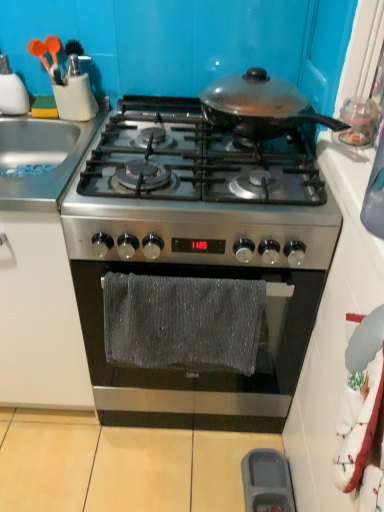
At what (x,y) coordinates should I click in order to perform the action: click on stainless steel gas stove at center, marked as the second gas stove in a top-to-bottom arrangement. Please return your answer as a coordinate pair (x, y). The width and height of the screenshot is (384, 512). Looking at the image, I should click on (196, 265).

In order to face stainless steel sink at left, should I rotate leftwards or rightwards?

You should look left and rotate roughly 21.708 degrees.

At what (x,y) coordinates should I click in order to perform the action: click on stainless steel gas stove at center, which appears as the 1th gas stove when viewed from the top. Please return your answer as a coordinate pair (x, y). Image resolution: width=384 pixels, height=512 pixels. Looking at the image, I should click on (197, 159).

The width and height of the screenshot is (384, 512). Identify the location of matte plastic utensils at upper left, which is counted as the second kitchen appliance, starting from the right. (12, 91).

Image resolution: width=384 pixels, height=512 pixels. Identify the location of stainless steel gas stove at center, marked as the second gas stove in a top-to-bottom arrangement. (196, 265).

Is point (221, 103) closer to camera compared to point (171, 339)?

No, it is not.

Between shiny black pan at center, arranged as the 2th kitchen appliance when viewed from the left, and gray textured towel at center, which one has larger size?

shiny black pan at center, arranged as the 2th kitchen appliance when viewed from the left, is bigger.

Who is shorter, shiny black pan at center, positioned as the first kitchen appliance in right-to-left order, or gray textured towel at center?

With less height is shiny black pan at center, positioned as the first kitchen appliance in right-to-left order.

Is shiny black pan at center, arranged as the 2th kitchen appliance when viewed from the left, aimed at gray textured towel at center?

No, shiny black pan at center, arranged as the 2th kitchen appliance when viewed from the left, is not oriented towards gray textured towel at center.

This screenshot has height=512, width=384. In order to click on sink that is above the stainless steel gas stove at center, marked as the second gas stove in a top-to-bottom arrangement (from a real-world perspective) in this screenshot , I will do click(x=42, y=158).

Is stainless steel sink at left positioned with its back to stainless steel gas stove at center, marked as the second gas stove in a top-to-bottom arrangement?

stainless steel sink at left does not have its back to stainless steel gas stove at center, marked as the second gas stove in a top-to-bottom arrangement.

Looking at this image, from the image's perspective, does stainless steel sink at left appear lower than stainless steel gas stove at center, positioned as the 1th gas stove in bottom-to-top order?

No, from the image's perspective, stainless steel sink at left is not below stainless steel gas stove at center, positioned as the 1th gas stove in bottom-to-top order.

Looking at this image, which is further, (44, 182) or (103, 137)?

The point (103, 137) is more distant.

Find the location of a particular element. This screenshot has width=384, height=512. the 2nd gas stove positioned above the gray textured towel at center (from the image's perspective) is located at coordinates (197, 159).

Which object is further away from the camera taking this photo, gray textured towel at center or stainless steel gas stove at center, the second gas stove in the bottom-to-top sequence?

gray textured towel at center is more distant.

Does gray textured towel at center appear on the left side of stainless steel gas stove at center, which appears as the 1th gas stove when viewed from the top?

Yes, gray textured towel at center is to the left of stainless steel gas stove at center, which appears as the 1th gas stove when viewed from the top.

Are stainless steel gas stove at center, positioned as the 1th gas stove in bottom-to-top order, and gray textured towel at center far apart?

stainless steel gas stove at center, positioned as the 1th gas stove in bottom-to-top order, is actually quite close to gray textured towel at center.

Who is more distant, stainless steel gas stove at center, marked as the second gas stove in a top-to-bottom arrangement, or gray textured towel at center?

stainless steel gas stove at center, marked as the second gas stove in a top-to-bottom arrangement, is behind.

From the image's perspective, does stainless steel gas stove at center, marked as the second gas stove in a top-to-bottom arrangement, appear lower than gray textured towel at center?

Actually, stainless steel gas stove at center, marked as the second gas stove in a top-to-bottom arrangement, appears above gray textured towel at center in the image.

Is stainless steel gas stove at center, positioned as the 1th gas stove in bottom-to-top order, smaller than gray textured towel at center?

Incorrect, stainless steel gas stove at center, positioned as the 1th gas stove in bottom-to-top order, is not smaller in size than gray textured towel at center.

From the image's perspective, which is below, stainless steel gas stove at center, marked as the second gas stove in a top-to-bottom arrangement, or shiny black pan at center, positioned as the first kitchen appliance in right-to-left order?

stainless steel gas stove at center, marked as the second gas stove in a top-to-bottom arrangement, from the image's perspective.

Is stainless steel gas stove at center, marked as the second gas stove in a top-to-bottom arrangement, to the left or to the right of shiny black pan at center, positioned as the first kitchen appliance in right-to-left order, in the image?

From the image, it's evident that stainless steel gas stove at center, marked as the second gas stove in a top-to-bottom arrangement, is to the left of shiny black pan at center, positioned as the first kitchen appliance in right-to-left order.

Which is in front, point (259, 223) or point (211, 96)?

Positioned in front is point (259, 223).

From a real-world perspective, is stainless steel gas stove at center, positioned as the 1th gas stove in bottom-to-top order, above or below shiny black pan at center, positioned as the first kitchen appliance in right-to-left order?

From a real-world perspective, stainless steel gas stove at center, positioned as the 1th gas stove in bottom-to-top order, is physically below shiny black pan at center, positioned as the first kitchen appliance in right-to-left order.

Considering the sizes of shiny black pan at center, positioned as the first kitchen appliance in right-to-left order, and gray plastic tray at lower center in the image, is shiny black pan at center, positioned as the first kitchen appliance in right-to-left order, bigger or smaller than gray plastic tray at lower center?

In the image, shiny black pan at center, positioned as the first kitchen appliance in right-to-left order, appears to be larger than gray plastic tray at lower center.

Is shiny black pan at center, positioned as the first kitchen appliance in right-to-left order, touching gray plastic tray at lower center?

No, shiny black pan at center, positioned as the first kitchen appliance in right-to-left order, is not next to gray plastic tray at lower center.

Is shiny black pan at center, arranged as the 2th kitchen appliance when viewed from the left, positioned before gray plastic tray at lower center?

Yes, shiny black pan at center, arranged as the 2th kitchen appliance when viewed from the left, is closer to the viewer.

Which is behind, point (276, 84) or point (288, 470)?

Positioned behind is point (276, 84).

Can you confirm if stainless steel sink at left is shorter than shiny black pan at center, arranged as the 2th kitchen appliance when viewed from the left?

No, stainless steel sink at left is not shorter than shiny black pan at center, arranged as the 2th kitchen appliance when viewed from the left.

From the image's perspective, between stainless steel sink at left and shiny black pan at center, positioned as the first kitchen appliance in right-to-left order, who is located below?

stainless steel sink at left, from the image's perspective.

Is stainless steel sink at left touching shiny black pan at center, arranged as the 2th kitchen appliance when viewed from the left?

No, stainless steel sink at left is not making contact with shiny black pan at center, arranged as the 2th kitchen appliance when viewed from the left.

From a real-world perspective, between stainless steel sink at left and shiny black pan at center, arranged as the 2th kitchen appliance when viewed from the left, who is vertically higher?

In real-world perspective, shiny black pan at center, arranged as the 2th kitchen appliance when viewed from the left, is above.

This screenshot has height=512, width=384. I want to click on material behind the shiny black pan at center, arranged as the 2th kitchen appliance when viewed from the left, so [x=182, y=322].

This screenshot has width=384, height=512. What are the coordinates of `gas stove that is the 2nd one when counting downward from the stainless steel sink at left (from the image's perspective)` in the screenshot? It's located at (196, 265).

Which object lies nearer to the anchor point gray textured towel at center, stainless steel gas stove at center, marked as the second gas stove in a top-to-bottom arrangement, or shiny black pan at center, positioned as the first kitchen appliance in right-to-left order?

stainless steel gas stove at center, marked as the second gas stove in a top-to-bottom arrangement.

From the image, which object appears to be nearer to stainless steel sink at left, shiny black pan at center, positioned as the first kitchen appliance in right-to-left order, or matte plastic utensils at upper left, the first kitchen appliance when ordered from left to right?

Among the two, matte plastic utensils at upper left, the first kitchen appliance when ordered from left to right, is located nearer to stainless steel sink at left.

From the image, which object appears to be nearer to gray plastic tray at lower center, stainless steel gas stove at center, positioned as the 1th gas stove in bottom-to-top order, or matte plastic utensils at upper left, which is counted as the second kitchen appliance, starting from the right?

Based on the image, stainless steel gas stove at center, positioned as the 1th gas stove in bottom-to-top order, appears to be nearer to gray plastic tray at lower center.

When comparing their distances from stainless steel gas stove at center, which appears as the 1th gas stove when viewed from the top, does shiny black pan at center, positioned as the first kitchen appliance in right-to-left order, or stainless steel sink at left seem further?

stainless steel sink at left lies further to stainless steel gas stove at center, which appears as the 1th gas stove when viewed from the top, than the other object.

Looking at the image, which one is located closer to stainless steel sink at left, matte plastic utensils at upper left, the first kitchen appliance when ordered from left to right, or gray plastic tray at lower center?

matte plastic utensils at upper left, the first kitchen appliance when ordered from left to right, lies closer to stainless steel sink at left than the other object.

When comparing their distances from stainless steel sink at left, does stainless steel gas stove at center, which appears as the 1th gas stove when viewed from the top, or shiny black pan at center, arranged as the 2th kitchen appliance when viewed from the left, seem further?

shiny black pan at center, arranged as the 2th kitchen appliance when viewed from the left, is further to stainless steel sink at left.

From the image, which object appears to be nearer to shiny black pan at center, arranged as the 2th kitchen appliance when viewed from the left, stainless steel sink at left or stainless steel gas stove at center, marked as the second gas stove in a top-to-bottom arrangement?

stainless steel gas stove at center, marked as the second gas stove in a top-to-bottom arrangement.

Based on their spatial positions, is gray textured towel at center or stainless steel sink at left further from matte plastic utensils at upper left, which is counted as the second kitchen appliance, starting from the right?

gray textured towel at center.

At what (x,y) coordinates should I click in order to perform the action: click on sink between shiny black pan at center, positioned as the first kitchen appliance in right-to-left order, and gray plastic tray at lower center in the up-down direction. Please return your answer as a coordinate pair (x, y). Looking at the image, I should click on (42, 158).

Locate an element on the screen. This screenshot has width=384, height=512. material between stainless steel sink at left and gray plastic tray at lower center from top to bottom is located at coordinates (182, 322).

Where is `gas stove between matte plastic utensils at upper left, which is counted as the second kitchen appliance, starting from the right, and stainless steel gas stove at center, the second gas stove in the bottom-to-top sequence`? The width and height of the screenshot is (384, 512). gas stove between matte plastic utensils at upper left, which is counted as the second kitchen appliance, starting from the right, and stainless steel gas stove at center, the second gas stove in the bottom-to-top sequence is located at coordinates (196, 265).

You are a GUI agent. You are given a task and a screenshot of the screen. Output one action in this format:
    pyautogui.click(x=<x>, y=<y>)
    Task: Click on the gas stove that lies between shiny black pan at center, positioned as the first kitchen appliance in right-to-left order, and stainless steel gas stove at center, marked as the second gas stove in a top-to-bottom arrangement, from top to bottom
    The height and width of the screenshot is (512, 384).
    Given the screenshot: What is the action you would take?
    pyautogui.click(x=197, y=159)